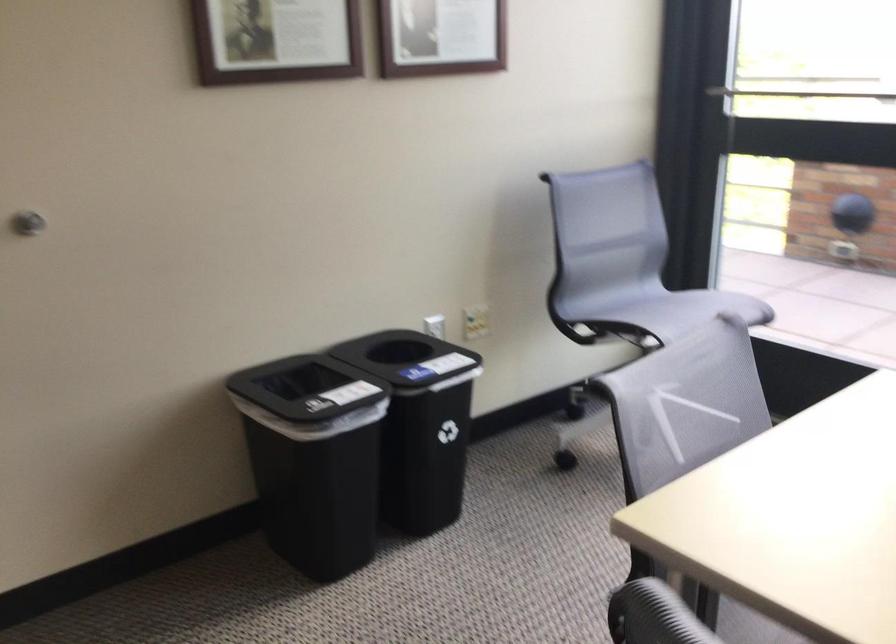
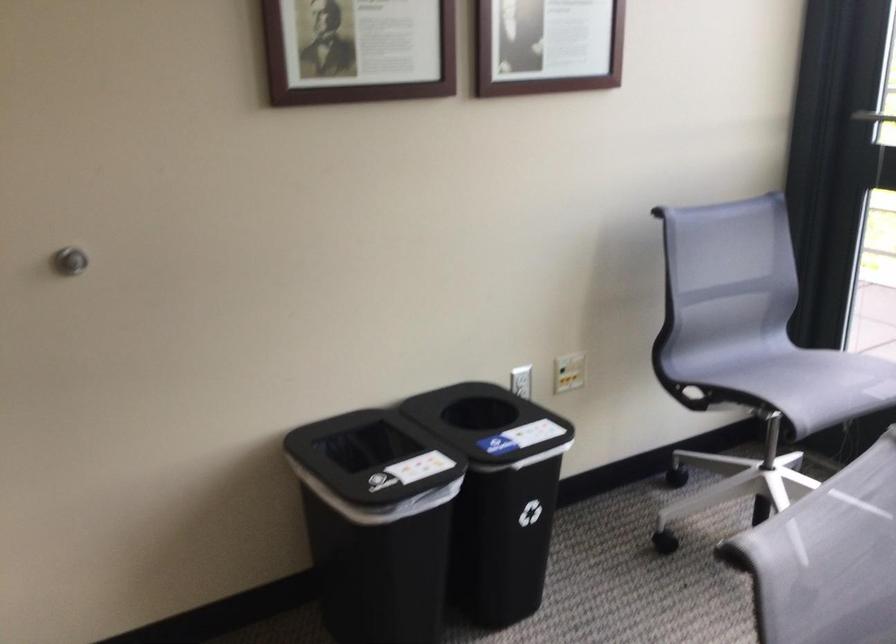
Find the pixel in the second image that matches pixel 678 313 in the first image.

(812, 382)